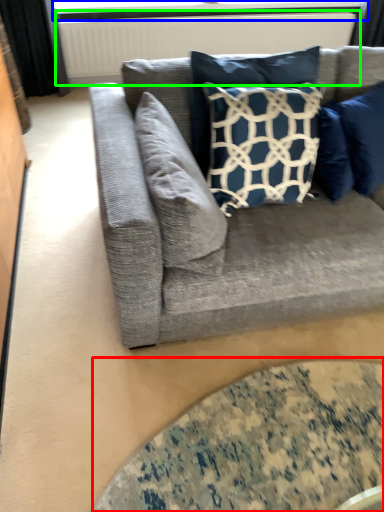
Question: Estimate the real-world distances between objects in this image. Which object is closer to glass table (highlighted by a red box), window screen (highlighted by a blue box) or radiator (highlighted by a green box)?

Choices:
 (A) window screen
 (B) radiator

Answer: (B)